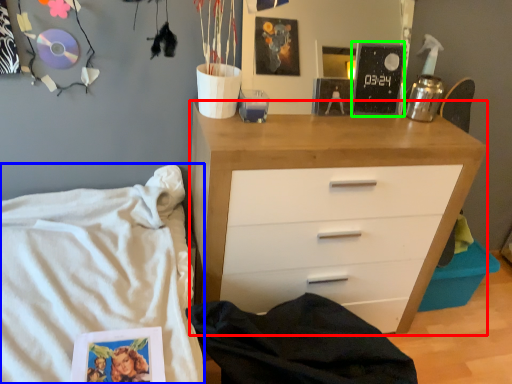
Question: Based on their relative distances, which object is farther from chest of drawers (highlighted by a red box)? Choose from bed (highlighted by a blue box) and magazine (highlighted by a green box).

Choices:
 (A) bed
 (B) magazine

Answer: (A)